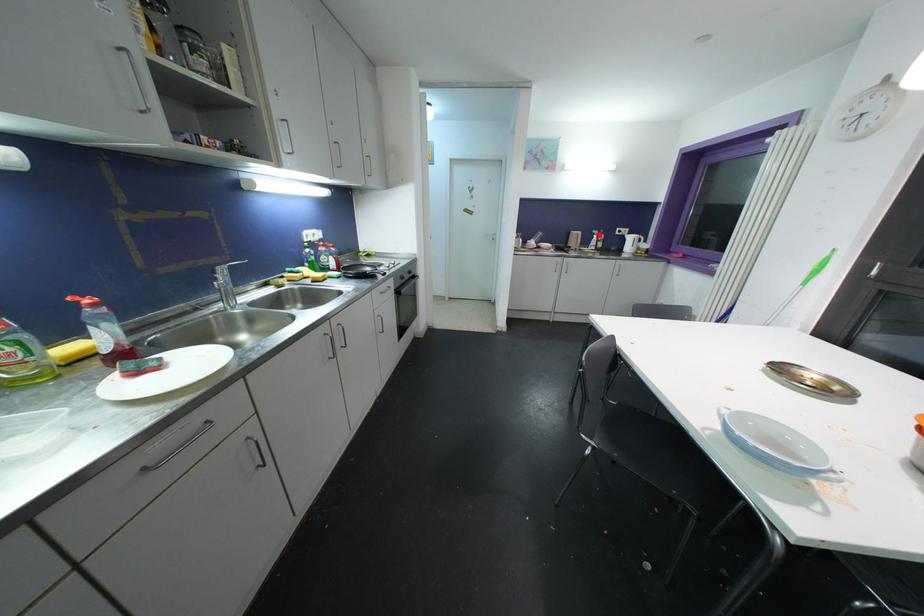
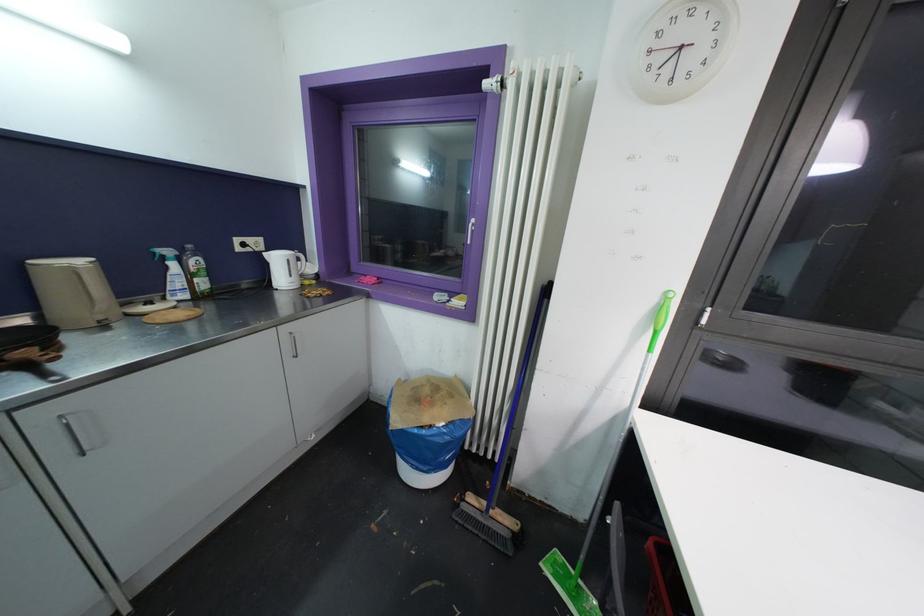
Question: I am providing you with two images of the same scene from different viewpoints. Given a red point in image1, look at the same physical point in image2. Is it:

Choices:
 (A) Closer to the viewpoint
 (B) Farther from the viewpoint

Answer: (B)